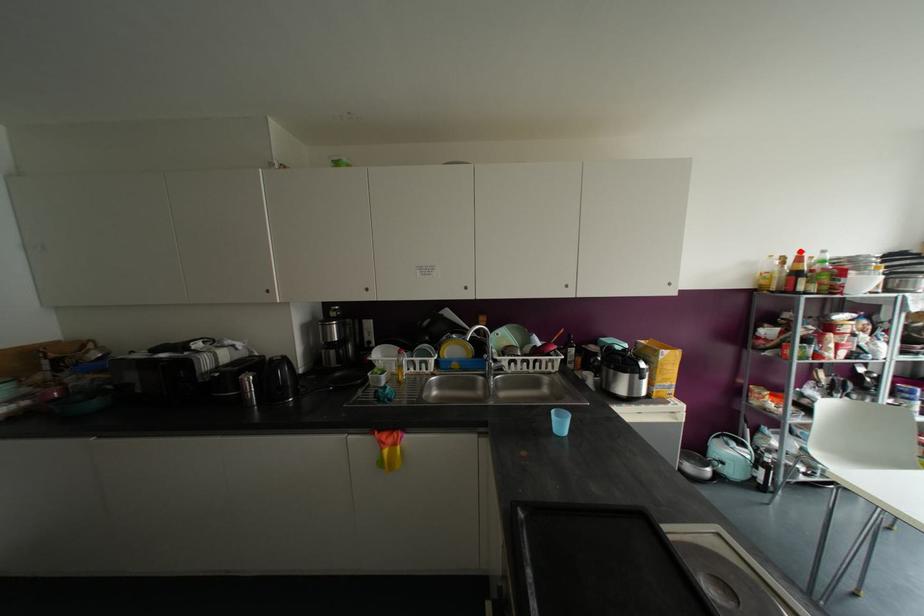
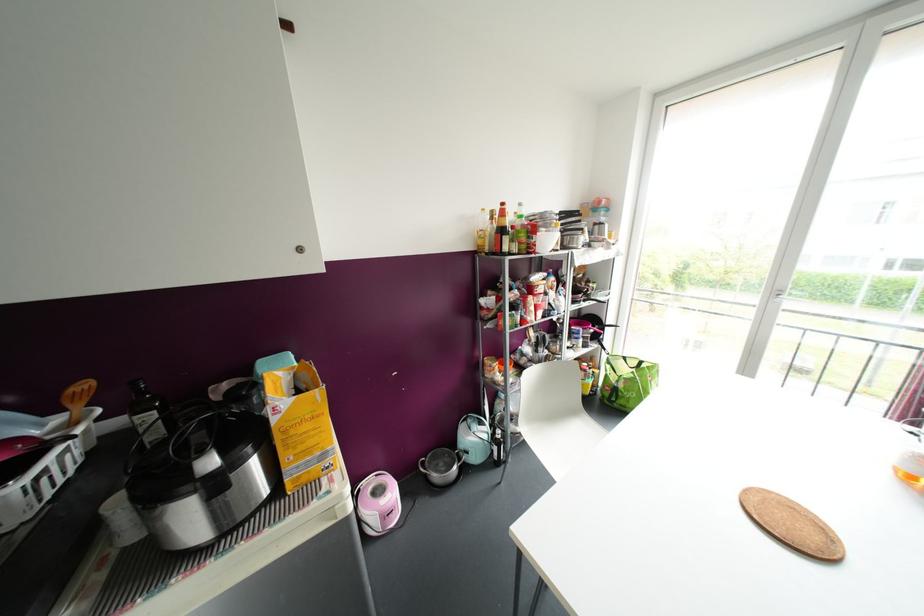
In the second image, find the point that corresponds to the highlighted location in the first image.

(502, 204)